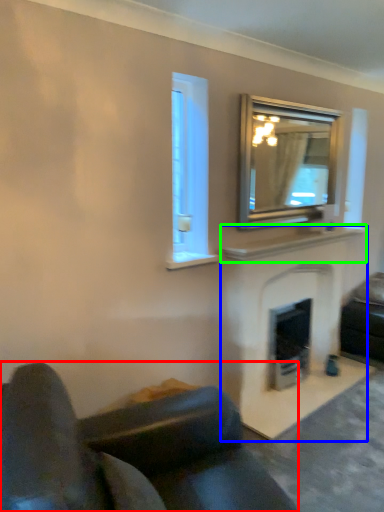
Question: Based on their relative distances, which object is nearer to studio couch (highlighted by a red box)? Choose from fireplace (highlighted by a blue box) and mantle (highlighted by a green box).

Choices:
 (A) fireplace
 (B) mantle

Answer: (A)